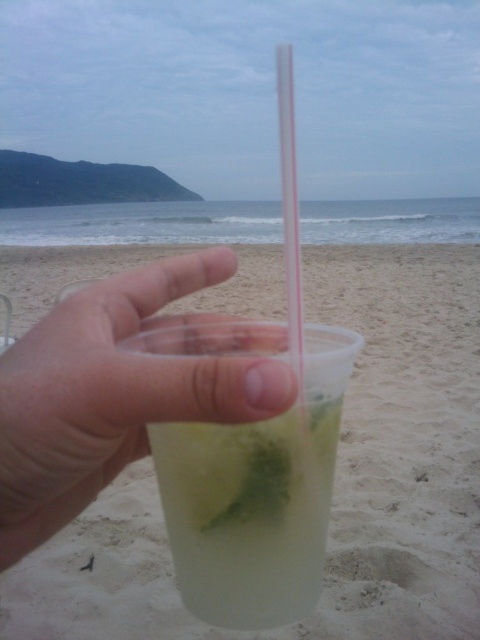
Who is positioned more to the left, clear plastic cup at center or translucent plastic cup at center?

From the viewer's perspective, clear plastic cup at center appears more on the left side.

Is point (135, 404) in front of point (160, 467)?

Yes.

Which is in front, point (118, 291) or point (242, 483)?

Point (242, 483) is in front.

Image resolution: width=480 pixels, height=640 pixels. Find the location of `clear plastic cup at center`. clear plastic cup at center is located at coordinates (110, 394).

What do you see at coordinates (249, 513) in the screenshot?
I see `translucent plastic cup at center` at bounding box center [249, 513].

In the scene shown: Which of these two, translucent plastic cup at center or transparent plastic straw at center, stands taller?

Standing taller between the two is transparent plastic straw at center.

The height and width of the screenshot is (640, 480). Identify the location of translucent plastic cup at center. (249, 513).

At what (x,y) coordinates should I click in order to perform the action: click on translucent plastic cup at center. Please return your answer as a coordinate pair (x, y). Image resolution: width=480 pixels, height=640 pixels. Looking at the image, I should click on click(x=249, y=513).

Does clear plastic cup at center come behind transparent plastic straw at center?

No, clear plastic cup at center is in front of transparent plastic straw at center.

Which is in front, point (218, 260) or point (296, 280)?

Point (218, 260) is more forward.

Where is `clear plastic cup at center`? clear plastic cup at center is located at coordinates (110, 394).